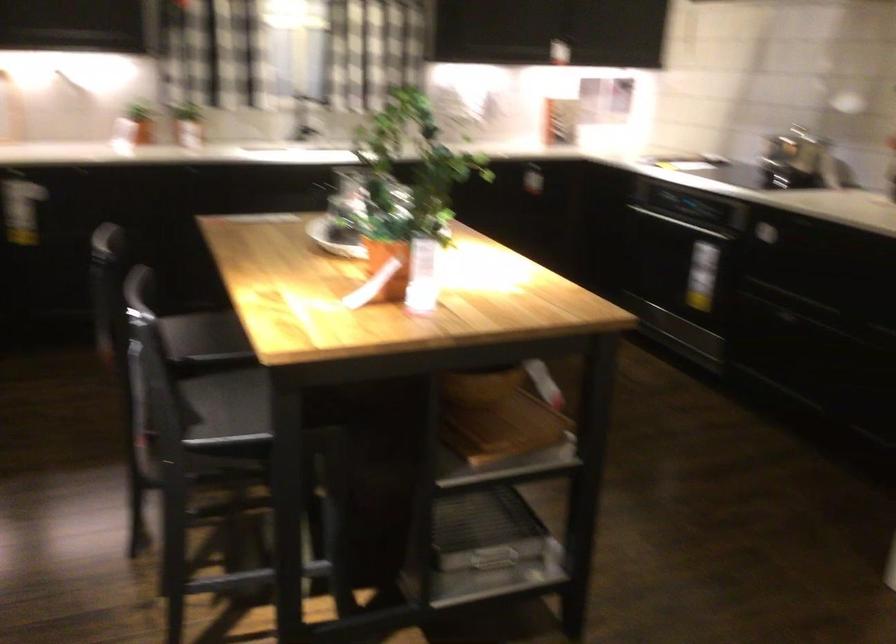
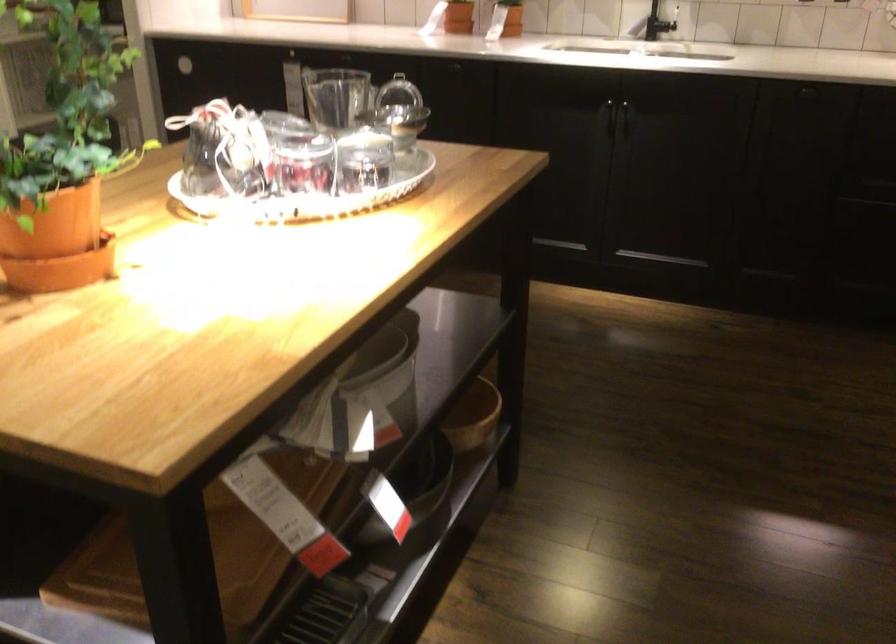
Where in the second image is the point corresponding to (199,140) from the first image?

(504, 31)